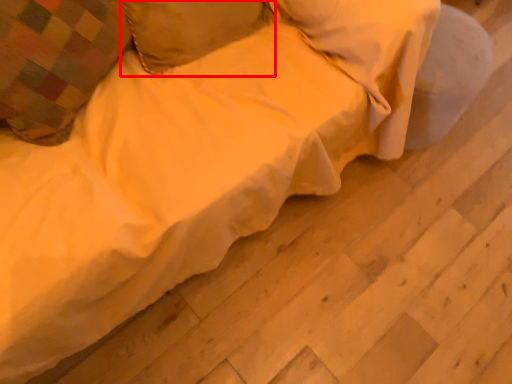
Question: In this image, where is pillow (annotated by the red box) located relative to pillow?

Choices:
 (A) right
 (B) left

Answer: (A)